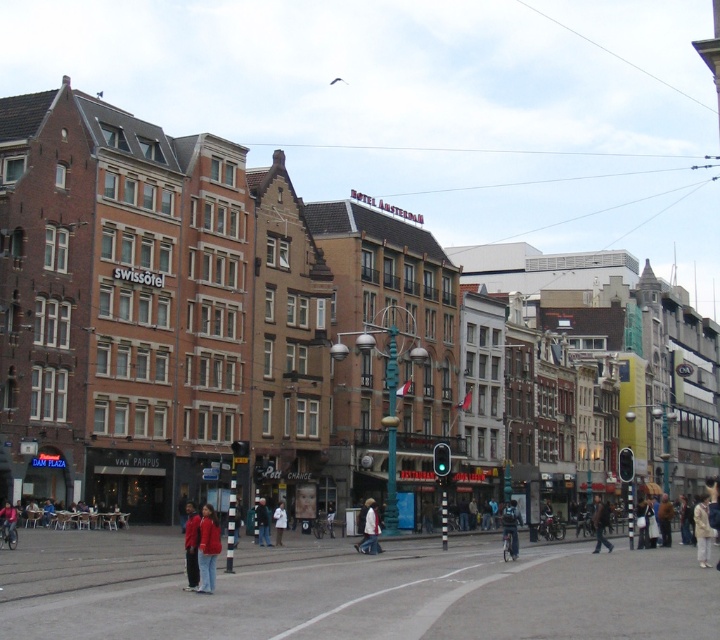
Is dark blue jeans at lower center bigger than white matte jacket at center?

Yes.

Is dark blue jeans at lower center in front of white matte jacket at center?

Yes.

Measure the distance between point (505, 508) and camera.

The distance of point (505, 508) from camera is 292.54 feet.

At what (x,y) coordinates should I click in order to perform the action: click on dark blue jeans at lower center. Please return your answer as a coordinate pair (x, y). The height and width of the screenshot is (640, 720). Looking at the image, I should click on point(510,529).

Which is below, red jacket at lower center or red fabric jacket at lower left?

red fabric jacket at lower left is below.

In order to click on red jacket at lower center in this screenshot , I will do `click(207, 548)`.

Does red fabric jacket at lower left have a lesser height compared to dark blue jeans at lower center?

Yes.

From the picture: Between red fabric jacket at lower left and dark blue jeans at lower center, which one has more height?

Standing taller between the two is dark blue jeans at lower center.

Which is in front, point (189, 540) or point (508, 512)?

Point (189, 540)

Locate an element on the screen. Image resolution: width=720 pixels, height=640 pixels. red fabric jacket at lower left is located at coordinates (192, 547).